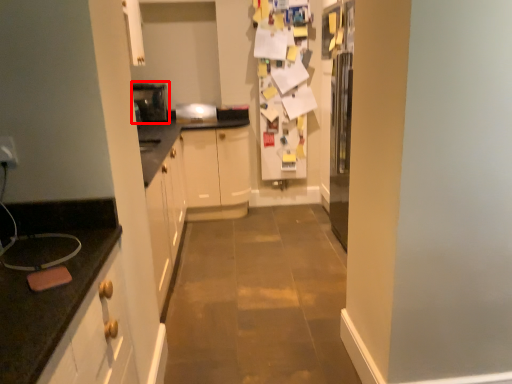
Question: From the image's perspective, where is appliance (annotated by the red box) located relative to appliance?

Choices:
 (A) above
 (B) below

Answer: (A)